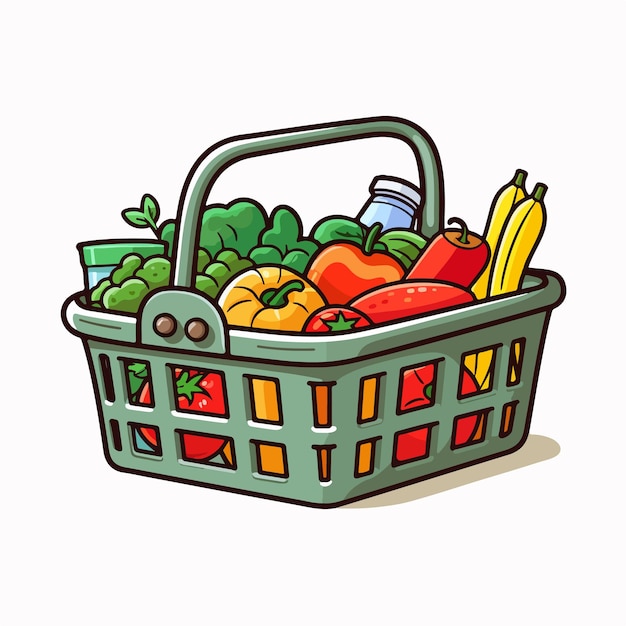
Identify the location of bottle. (392, 210).